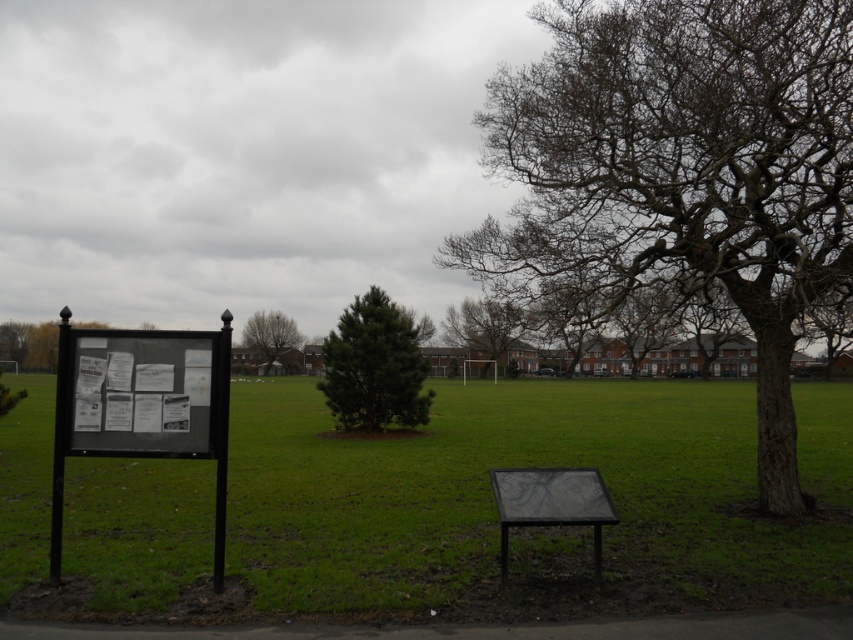
You are a gardener who wants to water both the bare wood tree at right and the green leafy tree at center. Which tree should you water first if you want to start from the closest one to you?

You should water the bare wood tree at right first because it is closer to the viewer than the green leafy tree at center.

You are a visitor in this park and want to sit on the black textured bench at center while staying under the shade of the green leafy tree at center. Is the bench positioned in a way that allows you to do so?

The black textured bench at center is below the green leafy tree at center, so sitting on the bench would place you under its shade.